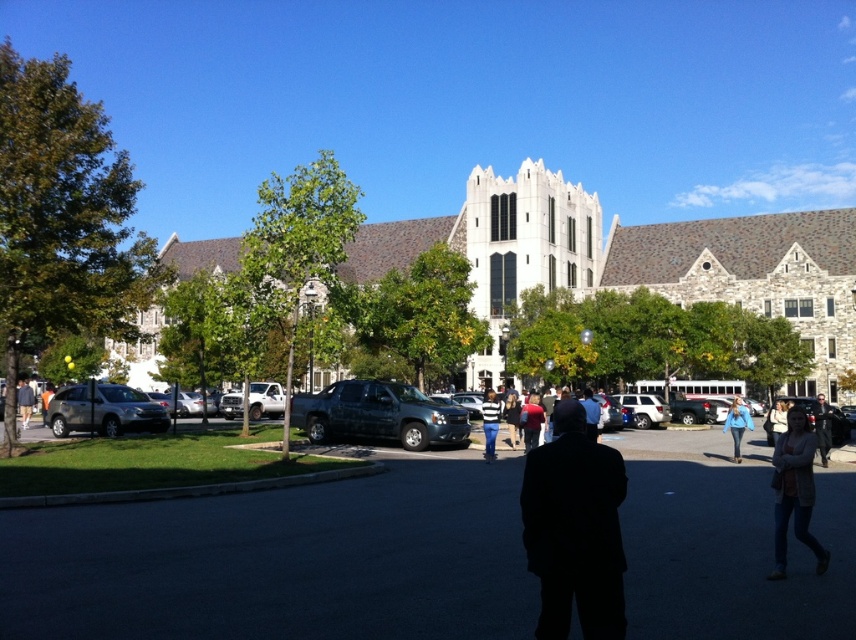
Who is lower down, matte black truck at center or red fabric shirt at center?

red fabric shirt at center

Is point (355, 412) behind point (535, 422)?

Yes, point (355, 412) is behind point (535, 422).

Does point (437, 410) come farther from viewer compared to point (531, 438)?

Yes, it is.

What are the coordinates of `matte black truck at center` in the screenshot? It's located at (378, 413).

Who is taller, matte black truck at center or striped sweater at center?

With more height is matte black truck at center.

Is matte black truck at center thinner than striped sweater at center?

In fact, matte black truck at center might be wider than striped sweater at center.

In order to click on matte black truck at center in this screenshot , I will do `click(378, 413)`.

Who is positioned more to the right, white stone church at center or dark blue jacket at center?

dark blue jacket at center is more to the right.

Based on the photo, who is more distant from viewer, (510, 205) or (596, 417)?

Positioned behind is point (510, 205).

What are the coordinates of `white stone church at center` in the screenshot? It's located at (633, 262).